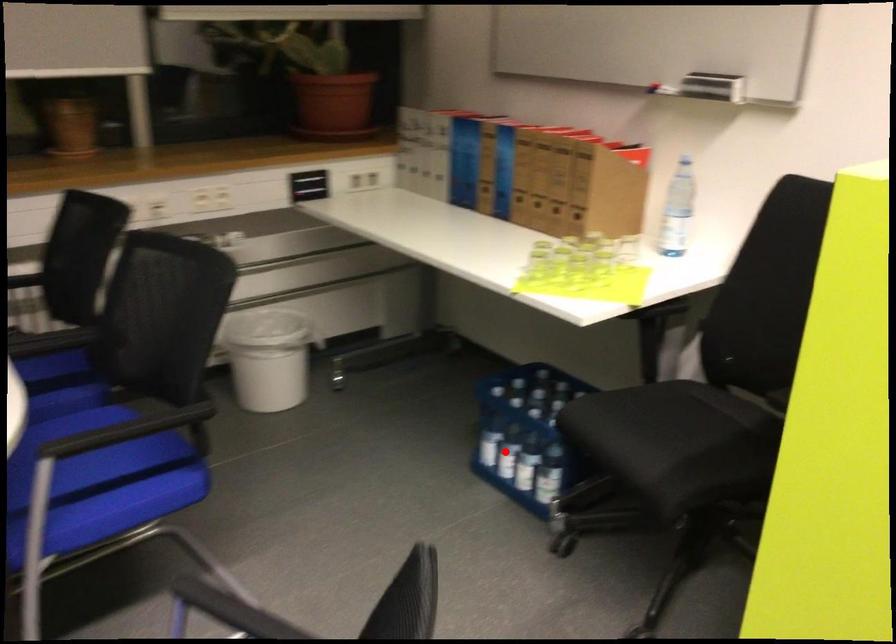
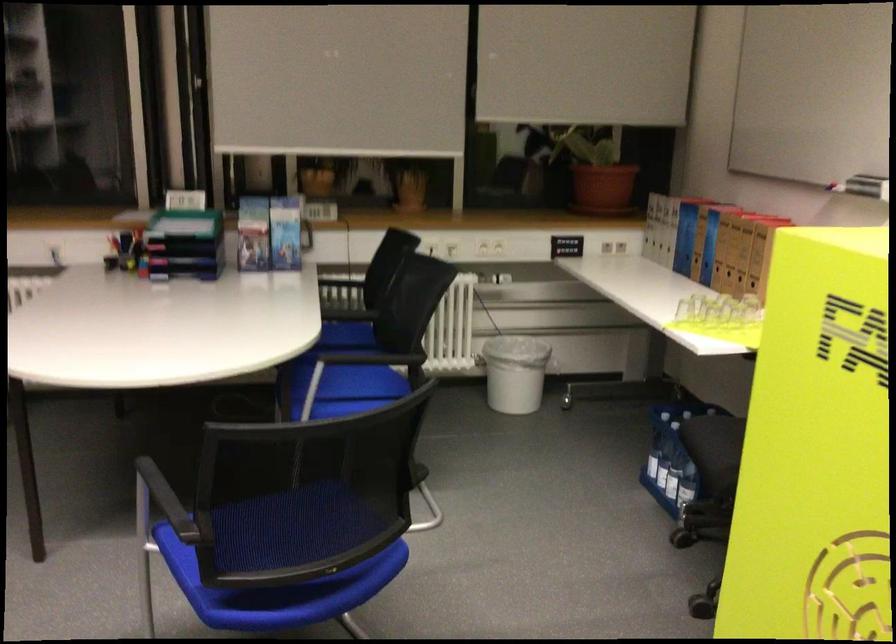
Where in the second image is the point corresponding to the highlighted location from the first image?

(661, 465)